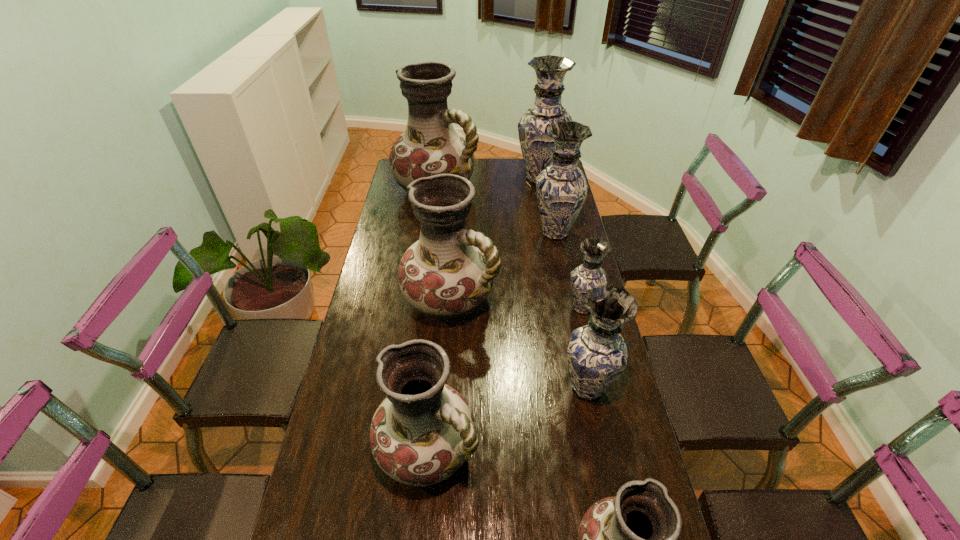
The image size is (960, 540). Find the location of `empty space between the third farthest blue vase and the third nearest red vase`. empty space between the third farthest blue vase and the third nearest red vase is located at coordinates (516, 304).

The height and width of the screenshot is (540, 960). I want to click on vacant space in between the second biggest red vase and the farthest blue vase, so click(495, 240).

Find the location of a particular element. vacant area between the third farthest blue vase and the biggest red vase is located at coordinates [510, 248].

This screenshot has height=540, width=960. In order to click on vacant space in between the smallest blue vase and the biggest blue vase in this screenshot , I will do `click(562, 244)`.

At what (x,y) coordinates should I click in order to perform the action: click on free space between the farthest red vase and the biggest blue vase. Please return your answer as a coordinate pair (x, y). Looking at the image, I should click on (489, 184).

Where is `object that is the sixth closest one to the second farthest red vase`? This screenshot has height=540, width=960. object that is the sixth closest one to the second farthest red vase is located at coordinates (536, 145).

Select which object is the second closest to the smallest red vase. Please provide its 2D coordinates. Your answer should be formatted as a tuple, i.e. [(x, y)], where the tuple contains the x and y coordinates of a point satisfying the conditions above.

[(597, 354)]

Point out which vase is positioned as the seventh nearest to the farthest blue vase. Please provide its 2D coordinates. Your answer should be formatted as a tuple, i.e. [(x, y)], where the tuple contains the x and y coordinates of a point satisfying the conditions above.

[(631, 539)]

Locate an element on the screen. vase that is the seventh closest one to the farthest blue vase is located at coordinates (631, 539).

At what (x,y) coordinates should I click in order to perform the action: click on red vase object that ranks as the third closest to the third farthest vase. Please return your answer as a coordinate pair (x, y). The image size is (960, 540). Looking at the image, I should click on (422, 432).